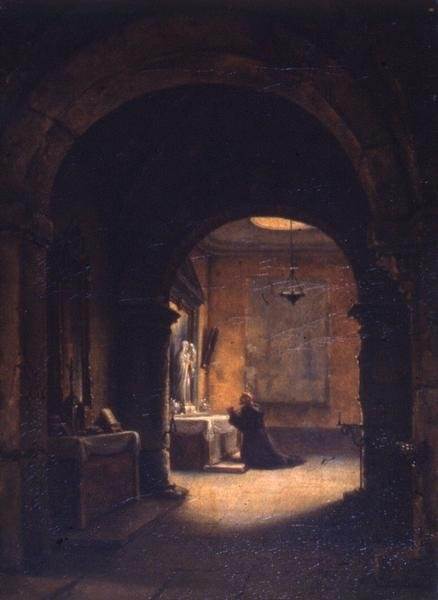
The height and width of the screenshot is (600, 438). Find the location of `lace cloth`. lace cloth is located at coordinates (196, 424).